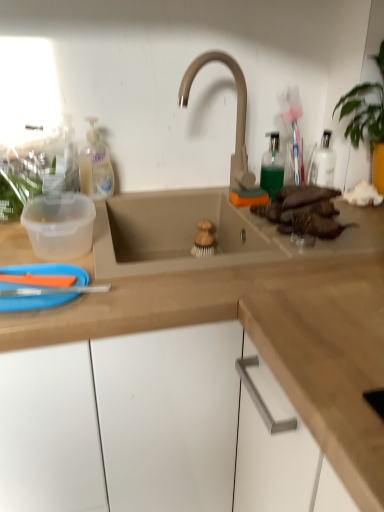
The width and height of the screenshot is (384, 512). Identify the location of transparent plastic container at left. (59, 225).

What do you see at coordinates (35, 301) in the screenshot? This screenshot has height=512, width=384. I see `blue plastic paper plate at lower left` at bounding box center [35, 301].

The width and height of the screenshot is (384, 512). Describe the element at coordinates (95, 165) in the screenshot. I see `translucent plastic bottle at upper left` at that location.

This screenshot has width=384, height=512. What are the coordinates of `transparent plastic container at left` in the screenshot? It's located at coord(59,225).

Considering the relative sizes of transparent plastic container at left and matte beige faucet at center in the image provided, is transparent plastic container at left shorter than matte beige faucet at center?

Indeed, transparent plastic container at left has a lesser height compared to matte beige faucet at center.

Find the location of a particular element. This screenshot has height=512, width=384. basin below the matte beige faucet at center (from the image's perspective) is located at coordinates (59, 225).

Can you confirm if transparent plastic container at left is thinner than matte beige faucet at center?

Incorrect, the width of transparent plastic container at left is not less than that of matte beige faucet at center.

Consider the image. Is transparent plastic container at left inside or outside of matte beige faucet at center?

transparent plastic container at left exists outside the volume of matte beige faucet at center.

Would you say brown matte sweet potato at right is part of matte beige faucet at center's contents?

No, matte beige faucet at center does not contain brown matte sweet potato at right.

Would you say matte beige faucet at center is a long distance from brown matte sweet potato at right?

matte beige faucet at center is near brown matte sweet potato at right, not far away.

From a real-world perspective, is matte beige faucet at center physically located above or below brown matte sweet potato at right?

matte beige faucet at center is above brown matte sweet potato at right.

In the scene shown: Is matte beige faucet at center facing towards brown matte sweet potato at right?

Yes, matte beige faucet at center is oriented towards brown matte sweet potato at right.

Would you say brown matte sweet potato at right is inside or outside transparent plastic container at left?

brown matte sweet potato at right is outside transparent plastic container at left.

Considering the positions of objects brown matte sweet potato at right and transparent plastic container at left in the image provided, who is more to the right, brown matte sweet potato at right or transparent plastic container at left?

Positioned to the right is brown matte sweet potato at right.

Image resolution: width=384 pixels, height=512 pixels. Find the location of `food on the right of the transparent plastic container at left`. food on the right of the transparent plastic container at left is located at coordinates (303, 211).

Is point (300, 227) closer or farther from the camera than point (73, 219)?

Point (300, 227).

Is brown matte sweet potato at right taller or shorter than green translucent bottle at upper right?

brown matte sweet potato at right is shorter than green translucent bottle at upper right.

Does brown matte sweet potato at right turn towards green translucent bottle at upper right?

No, brown matte sweet potato at right is not aimed at green translucent bottle at upper right.

From the image's perspective, is brown matte sweet potato at right beneath green translucent bottle at upper right?

Indeed, from the image's perspective, brown matte sweet potato at right is shown beneath green translucent bottle at upper right.

Does translucent plastic bottle at upper left contain transparent plastic container at left?

No, translucent plastic bottle at upper left does not contain transparent plastic container at left.

Considering the positions of point (81, 155) and point (78, 198), is point (81, 155) closer or farther from the camera than point (78, 198)?

Point (81, 155).

Is translucent plastic bottle at upper left oriented away from transparent plastic container at left?

No, translucent plastic bottle at upper left is not facing the opposite direction of transparent plastic container at left.

Which object is positioned more to the left, blue plastic paper plate at lower left or brown matte sweet potato at right?

blue plastic paper plate at lower left is more to the left.

Are blue plastic paper plate at lower left and brown matte sweet potato at right making contact?

No, blue plastic paper plate at lower left is not with brown matte sweet potato at right.

Could you tell me if blue plastic paper plate at lower left is turned towards brown matte sweet potato at right?

No, blue plastic paper plate at lower left is not turned towards brown matte sweet potato at right.

Does point (70, 298) lie in front of point (297, 210)?

Yes, it is in front of point (297, 210).

Considering the positions of objects blue plastic paper plate at lower left and green translucent bottle at upper right in the image provided, who is in front, blue plastic paper plate at lower left or green translucent bottle at upper right?

blue plastic paper plate at lower left is in front.

You are a GUI agent. You are given a task and a screenshot of the screen. Output one action in this format:
    pyautogui.click(x=<x>, y=<y>)
    Task: Click on the paper plate below the green translucent bottle at upper right (from a real-world perspective)
    
    Given the screenshot: What is the action you would take?
    pyautogui.click(x=35, y=301)

From a real-world perspective, relative to green translucent bottle at upper right, is blue plastic paper plate at lower left vertically above or below?

blue plastic paper plate at lower left is below green translucent bottle at upper right.

From the image's perspective, between blue plastic paper plate at lower left and green translucent bottle at upper right, which one is located above?

green translucent bottle at upper right.

At what (x,y) coordinates should I click in order to perform the action: click on tap on the right of transparent plastic container at left. Please return your answer as a coordinate pair (x, y). Looking at the image, I should click on (237, 113).

At what (x,y) coordinates should I click in order to perform the action: click on food in front of the matte beige faucet at center. Please return your answer as a coordinate pair (x, y). Looking at the image, I should click on (x=303, y=211).

Looking at the image, which one is located further to matte beige faucet at center, transparent plastic container at left or translucent plastic bottle at upper left?

transparent plastic container at left is further to matte beige faucet at center.

When comparing their distances from translucent plastic bottle at upper left, does blue plastic paper plate at lower left or matte beige faucet at center seem closer?

matte beige faucet at center is positioned closer to the anchor translucent plastic bottle at upper left.

From the image, which object appears to be nearer to matte beige faucet at center, translucent plastic bottle at upper left or transparent plastic container at left?

translucent plastic bottle at upper left is positioned closer to the anchor matte beige faucet at center.

When comparing their distances from green translucent bottle at upper right, does blue plastic paper plate at lower left or translucent plastic bottle at upper left seem closer?

translucent plastic bottle at upper left lies closer to green translucent bottle at upper right than the other object.

Looking at the image, which one is located closer to brown matte sweet potato at right, blue plastic paper plate at lower left or matte beige faucet at center?

matte beige faucet at center lies closer to brown matte sweet potato at right than the other object.

Considering their positions, is matte beige faucet at center positioned closer to blue plastic paper plate at lower left than brown matte sweet potato at right?

Based on the image, brown matte sweet potato at right appears to be nearer to blue plastic paper plate at lower left.

Estimate the real-world distances between objects in this image. Which object is further from transparent plastic container at left, matte beige faucet at center or brown matte sweet potato at right?

Based on the image, brown matte sweet potato at right appears to be further to transparent plastic container at left.

Considering their positions, is matte beige faucet at center positioned further to translucent plastic bottle at upper left than brown matte sweet potato at right?

Based on the image, brown matte sweet potato at right appears to be further to translucent plastic bottle at upper left.

The image size is (384, 512). I want to click on basin between blue plastic paper plate at lower left and green translucent bottle at upper right from left to right, so click(59, 225).

The image size is (384, 512). I want to click on basin situated between blue plastic paper plate at lower left and matte beige faucet at center from left to right, so click(59, 225).

Identify the location of tap between blue plastic paper plate at lower left and brown matte sweet potato at right from left to right. The height and width of the screenshot is (512, 384). [237, 113].

This screenshot has width=384, height=512. In order to click on tap between translucent plastic bottle at upper left and green translucent bottle at upper right from left to right in this screenshot , I will do coord(237,113).